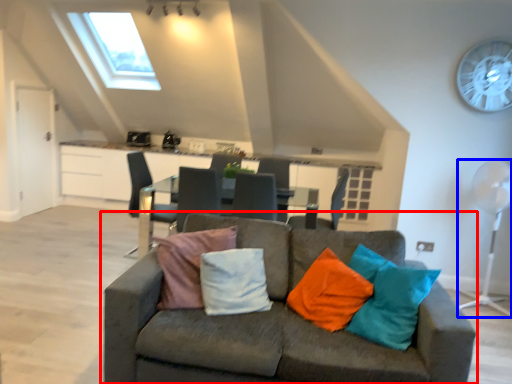
Question: Which point is closer to the camera, studio couch (highlighted by a red box) or mechanical fan (highlighted by a blue box)?

Choices:
 (A) studio couch
 (B) mechanical fan

Answer: (A)